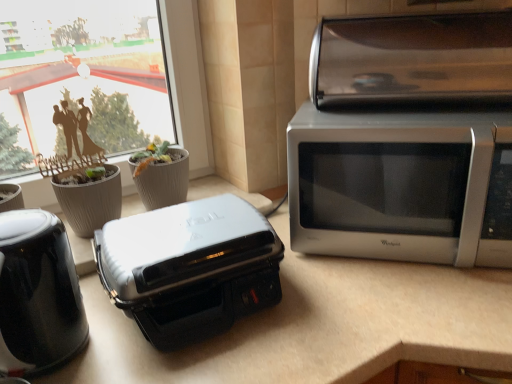
Question: Can you confirm if white glossy countertop at center is thinner than satin silver microwave at right?

Choices:
 (A) no
 (B) yes

Answer: (A)

Question: From the image's perspective, is white glossy countertop at center located above satin silver microwave at right?

Choices:
 (A) yes
 (B) no

Answer: (B)

Question: Could satin silver microwave at right be considered to be inside white glossy countertop at center?

Choices:
 (A) yes
 (B) no

Answer: (B)

Question: Is white glossy countertop at center bigger than satin silver microwave at right?

Choices:
 (A) no
 (B) yes

Answer: (B)

Question: Can you confirm if white glossy countertop at center is shorter than satin silver microwave at right?

Choices:
 (A) yes
 (B) no

Answer: (B)

Question: Does point (103, 216) appear closer or farther from the camera than point (501, 34)?

Choices:
 (A) closer
 (B) farther

Answer: (B)

Question: From the image's perspective, is gray textured flowerpot at left, which is the first flowerpot from left to right, positioned above or below satin silver toaster oven at upper right?

Choices:
 (A) above
 (B) below

Answer: (B)

Question: From a real-world perspective, is gray textured flowerpot at left, which is the first flowerpot from left to right, physically located above or below satin silver toaster oven at upper right?

Choices:
 (A) below
 (B) above

Answer: (A)

Question: Is gray textured flowerpot at left, acting as the 2th flowerpot starting from the right, bigger or smaller than satin silver toaster oven at upper right?

Choices:
 (A) big
 (B) small

Answer: (B)

Question: Is point (492, 296) closer or farther from the camera than point (84, 236)?

Choices:
 (A) farther
 (B) closer

Answer: (B)

Question: Which is correct: white glossy countertop at center is inside gray textured flowerpot at left, which is the first flowerpot from left to right, or outside of it?

Choices:
 (A) inside
 (B) outside

Answer: (B)

Question: In the image, is white glossy countertop at center positioned in front of or behind gray textured flowerpot at left, which is the first flowerpot from left to right?

Choices:
 (A) front
 (B) behind

Answer: (A)

Question: In terms of height, does white glossy countertop at center look taller or shorter compared to gray textured flowerpot at left, which is the first flowerpot from left to right?

Choices:
 (A) short
 (B) tall

Answer: (B)

Question: From a real-world perspective, is white glossy countertop at center positioned above or below satin silver microwave at right?

Choices:
 (A) above
 (B) below

Answer: (B)

Question: From the image's perspective, is white glossy countertop at center positioned above or below satin silver microwave at right?

Choices:
 (A) above
 (B) below

Answer: (B)